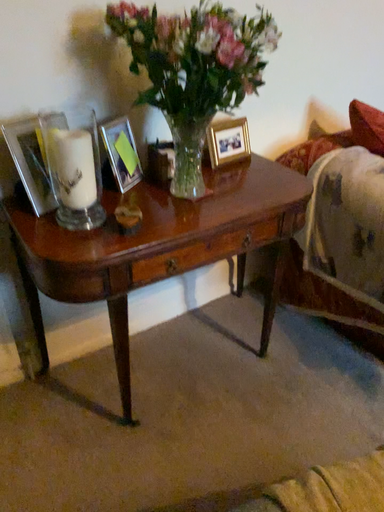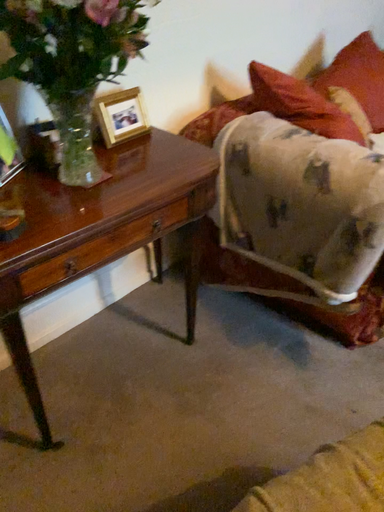
Question: How did the camera likely rotate when shooting the video?

Choices:
 (A) rotated right
 (B) rotated left

Answer: (A)